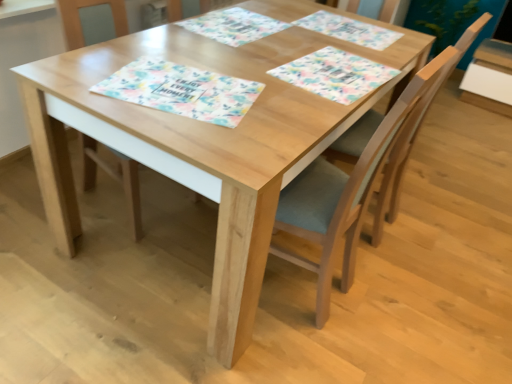
Question: Considering the positions of floral paper placemat at upper center, marked as the 1th place mat in a back-to-front arrangement, and light brown wood chair at center, the third chair positioned from the left, in the image, is floral paper placemat at upper center, marked as the 1th place mat in a back-to-front arrangement, wider or thinner than light brown wood chair at center, the third chair positioned from the left,?

Choices:
 (A) thin
 (B) wide

Answer: (A)

Question: Which is correct: floral paper placemat at upper center, which is counted as the 4th place mat, starting from the front, is inside light brown wood chair at center, the third chair positioned from the left, or outside of it?

Choices:
 (A) inside
 (B) outside

Answer: (B)

Question: Which of these objects is positioned farthest from the floral paper placemat at upper center, the third place mat in the front-to-back sequence?

Choices:
 (A) floral paper placemat at center, acting as the 2th place mat starting from the front
 (B) floral paper placemat at center, which is the 4th place mat in back-to-front order
 (C) wooden chair at center, which is the second chair from left to right
 (D) wooden chair at center, which is the third chair in right-to-left order
 (E) floral paper placemat at upper center, which is counted as the 4th place mat, starting from the front

Answer: (C)

Question: Estimate the real-world distances between objects in this image. Which object is farther from the light brown wood chair at center, the third chair positioned from the left?

Choices:
 (A) wooden chair at center, which is the third chair in right-to-left order
 (B) wooden chair at center, placed as the second chair when sorted from right to left
 (C) floral paper placemat at upper center, which is counted as the 4th place mat, starting from the front
 (D) floral paper placemat at upper center, the third place mat in the front-to-back sequence
 (E) floral paper placemat at center, which is the 3th place mat from back to front

Answer: (A)